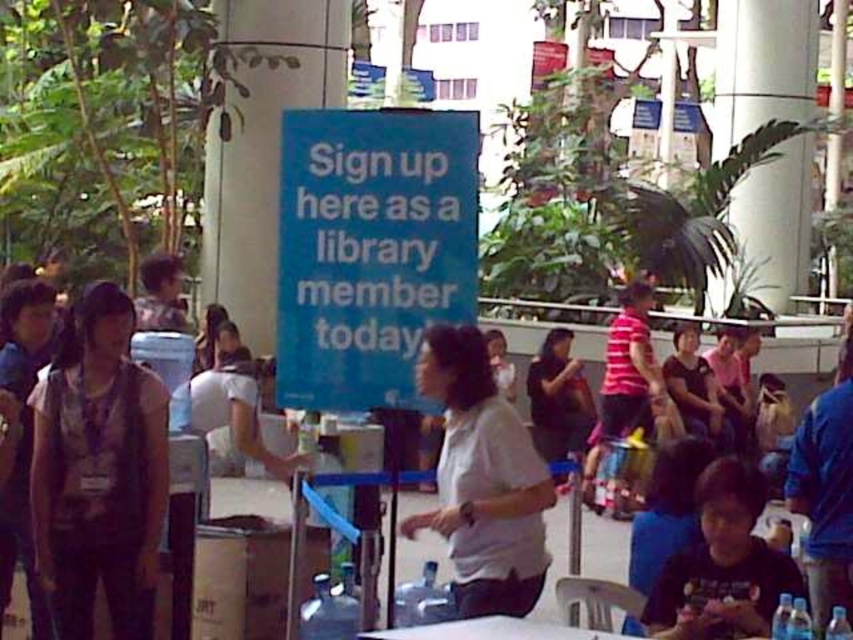
Which is more to the right, black matte shirt at lower right or white plastic table at lower center?

black matte shirt at lower right is more to the right.

Locate an element on the screen. The width and height of the screenshot is (853, 640). black matte shirt at lower right is located at coordinates (722, 564).

Locate an element on the screen. This screenshot has width=853, height=640. black matte shirt at lower right is located at coordinates (722, 564).

Is the position of black matte shirt at lower right more distant than that of dark gray shirt at center?

That is False.

Is black matte shirt at lower right smaller than dark gray shirt at center?

Yes.

Is point (738, 572) farther from viewer compared to point (537, 381)?

No, (738, 572) is closer to viewer.

The width and height of the screenshot is (853, 640). I want to click on black matte shirt at lower right, so click(x=722, y=564).

Who is more distant from viewer, [47,412] or [529,552]?

Point [47,412]

Between matte gray tank top at left and white matte shirt at center, which one is positioned higher?

white matte shirt at center

Image resolution: width=853 pixels, height=640 pixels. In order to click on matte gray tank top at left in this screenshot , I will do `click(97, 470)`.

The width and height of the screenshot is (853, 640). Identify the location of matte gray tank top at left. (97, 470).